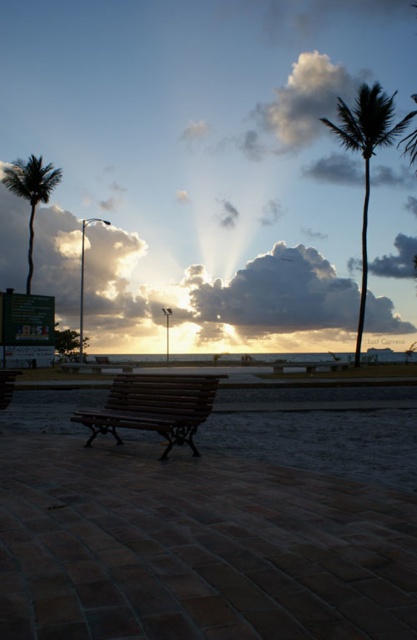
Between sandy yellow cloud at center and wooden bench at lower left, which one has more height?

sandy yellow cloud at center

Does sandy yellow cloud at center appear over wooden bench at lower left?

Yes, sandy yellow cloud at center is above wooden bench at lower left.

The height and width of the screenshot is (640, 417). In order to click on sandy yellow cloud at center in this screenshot , I will do click(273, 296).

Is point (387, 307) more distant than point (333, 90)?

No, it is in front of (333, 90).

The width and height of the screenshot is (417, 640). What do you see at coordinates (273, 296) in the screenshot?
I see `sandy yellow cloud at center` at bounding box center [273, 296].

What do you see at coordinates (273, 296) in the screenshot?
I see `sandy yellow cloud at center` at bounding box center [273, 296].

Where is `sandy yellow cloud at center`? The image size is (417, 640). sandy yellow cloud at center is located at coordinates (273, 296).

Who is taller, green leafy palm tree at right or wooden bench at lower left?

green leafy palm tree at right is taller.

Based on the photo, is green leafy palm tree at right to the left of wooden bench at lower left from the viewer's perspective?

No, green leafy palm tree at right is not to the left of wooden bench at lower left.

Does point (346, 109) lie behind point (19, 372)?

Yes, point (346, 109) is farther from viewer.

In order to click on green leafy palm tree at right in this screenshot , I will do `click(366, 156)`.